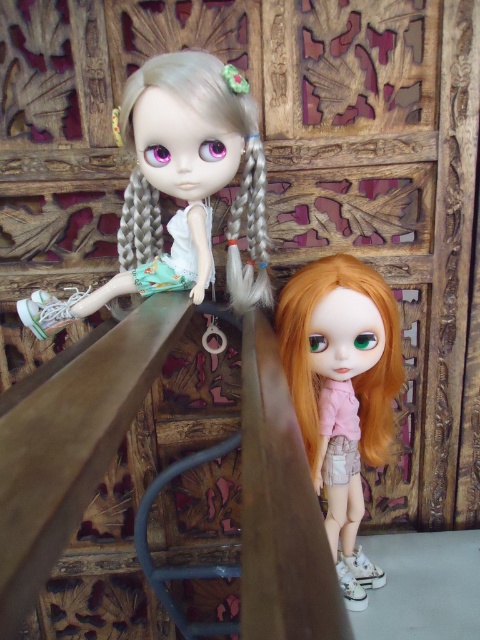
Can you confirm if matte white doll at upper left is thinner than satin silver pigtail at upper left?

Incorrect, matte white doll at upper left's width is not less than satin silver pigtail at upper left's.

At what (x,y) coordinates should I click in order to perform the action: click on matte white doll at upper left. Please return your answer as a coordinate pair (x, y). Looking at the image, I should click on [x=179, y=188].

Locate an element on the screen. The width and height of the screenshot is (480, 640). matte white doll at upper left is located at coordinates (179, 188).

From the picture: Can you confirm if matte pink shirt at center is wider than satin silver pigtail at upper left?

Yes.

Is matte pink shirt at center below satin silver pigtail at upper left?

Yes.

Is point (309, 440) in front of point (244, 280)?

That is False.

Identify the location of matte pink shirt at center. The image size is (480, 640). (342, 392).

Which is more to the right, matte white doll at upper left or matte pink shirt at center?

matte pink shirt at center

Measure the distance between matte white doll at upper left and matte pink shirt at center.

matte white doll at upper left and matte pink shirt at center are 8.63 inches apart.

Based on the photo, who is more forward, (45,298) or (387,360)?

Point (387,360)

In order to click on matte white doll at upper left in this screenshot , I will do `click(179, 188)`.